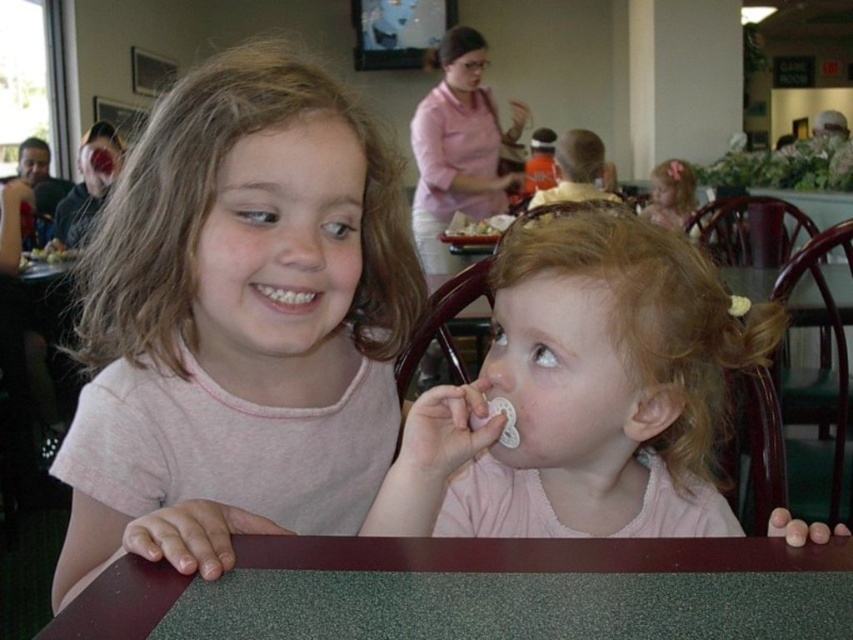
Question: Can you confirm if pink fabric pacifier at center is bigger than white matte food at center?

Choices:
 (A) yes
 (B) no

Answer: (A)

Question: Which object appears closest to the camera in this image?

Choices:
 (A) white matte food at center
 (B) pink fabric pacifier at center
 (C) pink cotton shirt at upper left

Answer: (C)

Question: Which object is closer to the camera taking this photo?

Choices:
 (A) smooth plastic spoon at upper right
 (B) green felt table at center
 (C) pink fabric pacifier at center
 (D) white matte food at center

Answer: (B)

Question: Which point is farther from the camera taking this photo?

Choices:
 (A) (73, 250)
 (B) (541, 394)
 (C) (178, 456)

Answer: (A)

Question: Can you confirm if green felt table at center is smaller than smooth plastic spoon at upper right?

Choices:
 (A) yes
 (B) no

Answer: (A)

Question: Can you confirm if pink cotton shirt at upper left is positioned below green felt table at center?

Choices:
 (A) yes
 (B) no

Answer: (B)